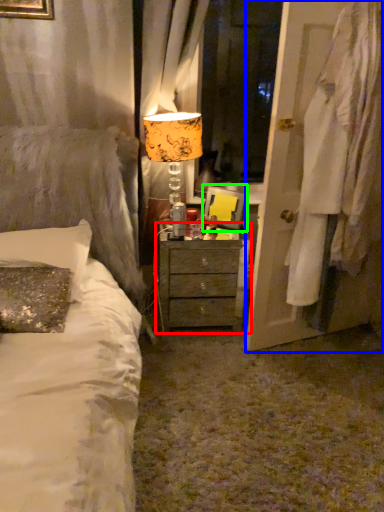
Question: Which object is the farthest from nightstand (highlighted by a red box)? Choose among these: door (highlighted by a blue box) or picture frame (highlighted by a green box).

Choices:
 (A) door
 (B) picture frame

Answer: (A)